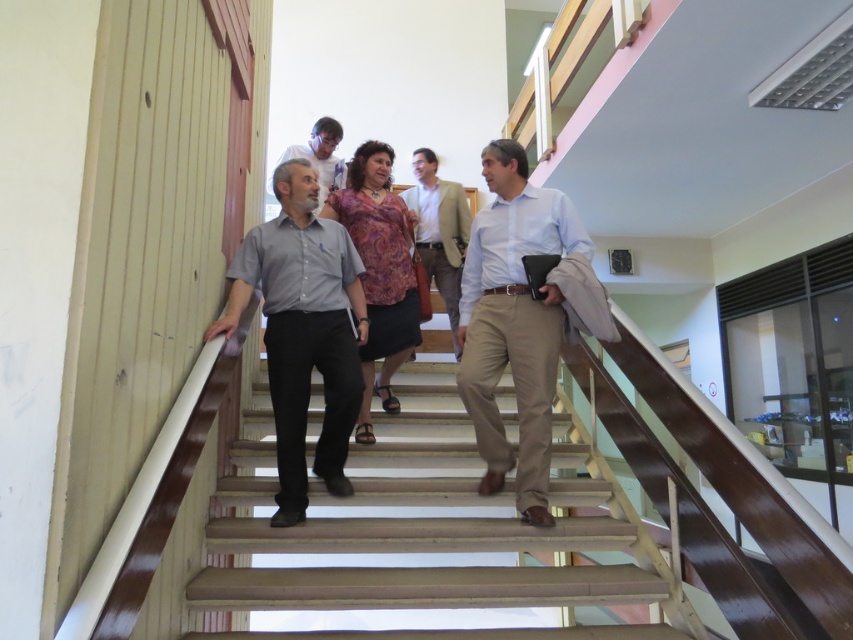
Question: Which object is positioned farthest from the wooden stairs at center?

Choices:
 (A) light blue shirt at center
 (B) light brown textured blazer at center

Answer: (B)

Question: Can you confirm if purple floral blouse at center is positioned above matte gray shirt at center?

Choices:
 (A) yes
 (B) no

Answer: (B)

Question: Which of these objects is positioned closest to the matte gray shirt at center?

Choices:
 (A) gray matte shirt at center
 (B) wooden stairs at center

Answer: (A)

Question: Among these objects, which one is nearest to the camera?

Choices:
 (A) light brown textured blazer at center
 (B) wooden stairs at center

Answer: (B)

Question: Can you confirm if gray matte shirt at center is positioned below light brown textured blazer at center?

Choices:
 (A) no
 (B) yes

Answer: (B)

Question: Can you confirm if light blue shirt at center is positioned above purple floral blouse at center?

Choices:
 (A) no
 (B) yes

Answer: (A)